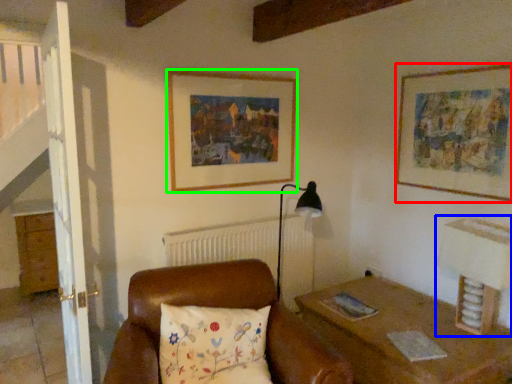
Question: Estimate the real-world distances between objects in this image. Which object is farther from picture frame (highlighted by a red box), table lamp (highlighted by a blue box) or picture frame (highlighted by a green box)?

Choices:
 (A) table lamp
 (B) picture frame

Answer: (B)